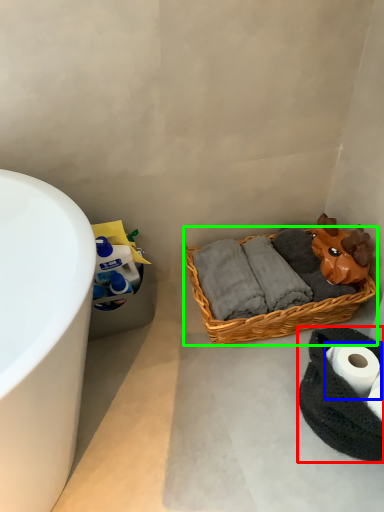
Question: Which is farther away from material (highlighted by a red box)? toilet paper (highlighted by a blue box) or picnic basket (highlighted by a green box)?

Choices:
 (A) toilet paper
 (B) picnic basket

Answer: (B)